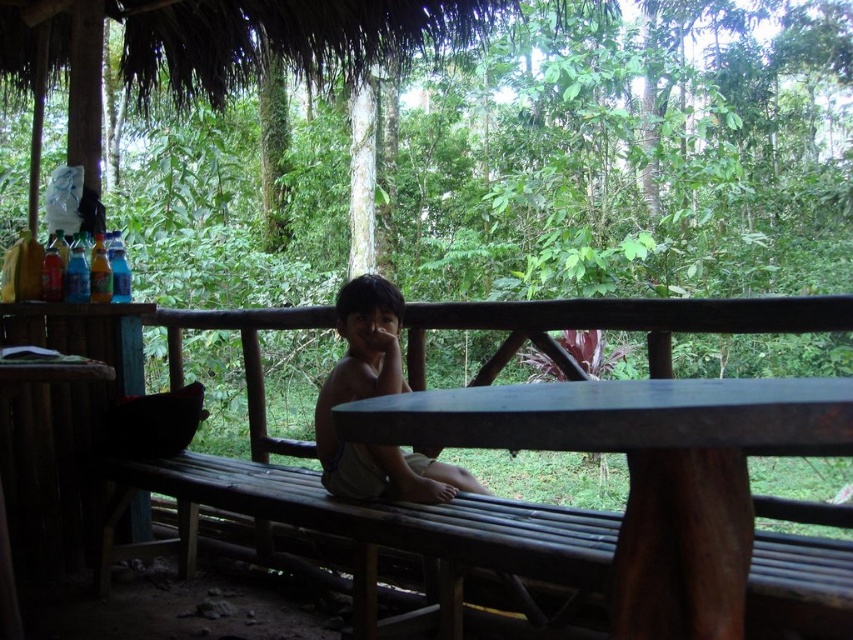
You are standing at the entrance of the rustic shelter and want to place a small potted plant on the smooth dark wood table at center. Based on the coordinates provided, can you confirm if the point marked at (647, 474) is the correct location for the table?

Yes, the point marked at (647, 474) corresponds to the smooth dark wood table at center, so placing the potted plant there would be accurate.